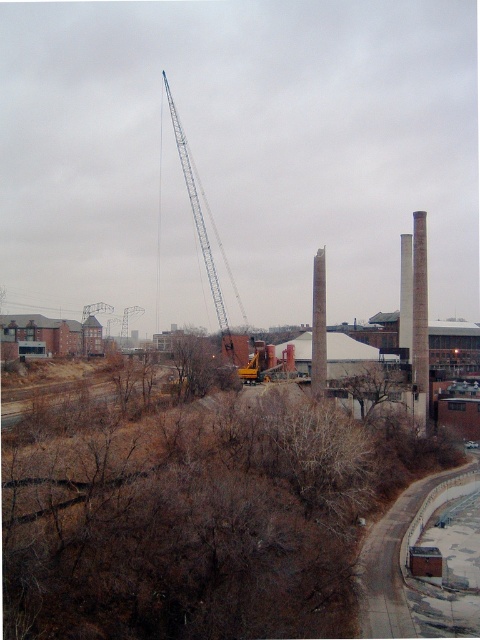
Question: Is blue metallic crane at center positioned in front of metallic gray crane at upper center?

Choices:
 (A) yes
 (B) no

Answer: (A)

Question: Which point is closer to the camera?

Choices:
 (A) gray concrete chimney at right
 (B) gray concrete chimney at center

Answer: (B)

Question: Does blue metallic crane at center appear over gray concrete chimney at center?

Choices:
 (A) no
 (B) yes

Answer: (B)

Question: Which is nearer to the blue metallic crane at center?

Choices:
 (A) brown rough tree at center
 (B) gray concrete chimney at center

Answer: (A)

Question: Is brown rough tree at center smaller than metallic gray crane at center?

Choices:
 (A) no
 (B) yes

Answer: (B)

Question: Estimate the real-world distances between objects in this image. Which object is closer to the metallic gray crane at center?

Choices:
 (A) metallic gray crane at upper center
 (B) brown leafless shrub at lower left

Answer: (A)